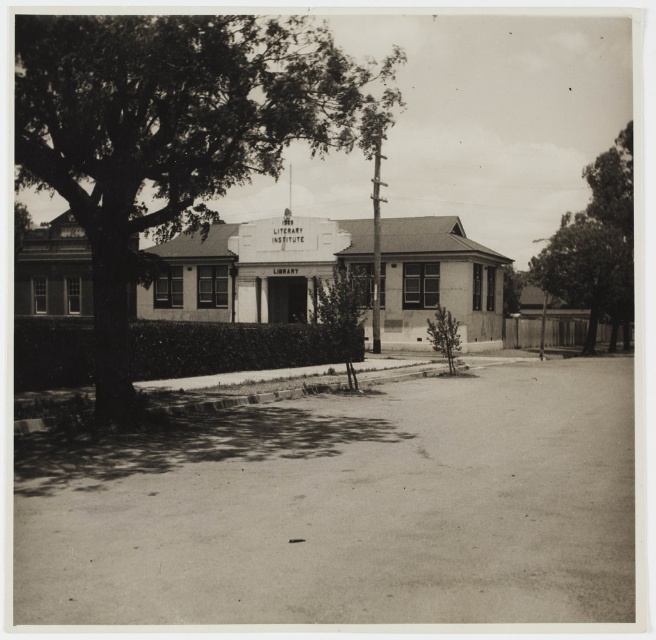
You are a photographer standing in front of the Literary Institute building. You want to take a photo that includes both the green leafy tree at upper left and the dark green leafy tree at right. Based on their positions, which tree will appear larger in the photo?

The green leafy tree at upper left will appear larger in the photo because it is closer to the viewer than the dark green leafy tree at right.

You are a landscape architect planning to install a new pathway between the green leafy tree at upper left and the dark green leafy tree at right. Based on their positions, which tree should the pathway be closer to?

The pathway should be closer to the dark green leafy tree at right because the green leafy tree at upper left is positioned over it, indicating it is farther away from the viewer and thus the pathway would need to be nearer to the closer tree to avoid obstruction.

You are standing at the entrance of the Literary Institute building and want to water the green leafy tree at upper left using a standard garden hose that can reach 25 feet. Can you water the tree without moving the hose nozzle?

The green leafy tree at upper left is 36.54 feet away from the viewer, which is farther than the 25 feet reach of the garden hose. Therefore, you cannot water the tree without moving the hose nozzle.